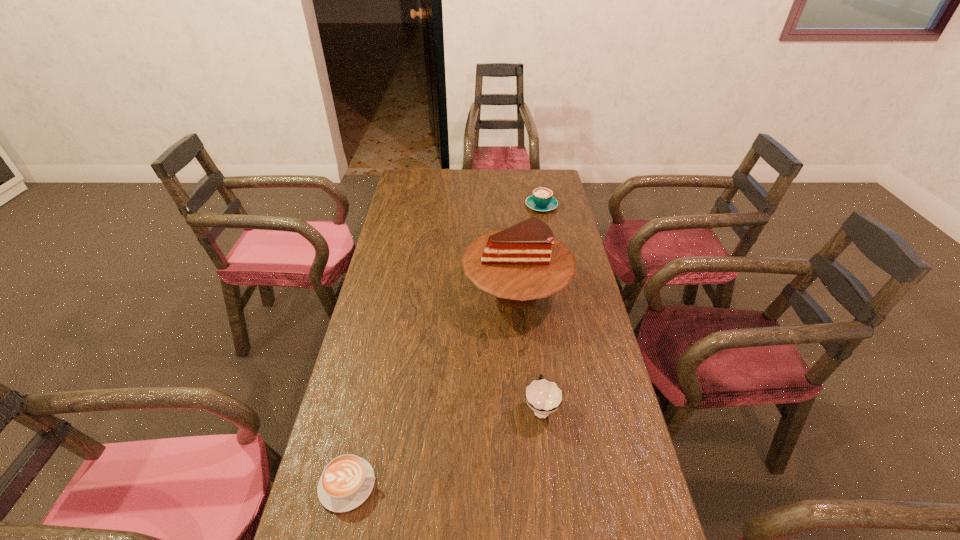
Image resolution: width=960 pixels, height=540 pixels. Identify the location of vacant space located on the side of the cup with the handle. pos(537,373).

What are the coordinates of `vacant space located 0.120m on the side of the cup with the handle` in the screenshot? It's located at (535, 353).

Locate an element on the screen. The height and width of the screenshot is (540, 960). blank space located with the handle on the right side of the right cappuccino is located at coordinates (539, 191).

At what (x,y) coordinates should I click in order to perform the action: click on vacant region located 0.130m with the handle on the right side of the right cappuccino. Please return your answer as a coordinate pair (x, y). Looking at the image, I should click on (537, 183).

Find the location of `free space located 0.140m with the handle on the right side of the right cappuccino`. free space located 0.140m with the handle on the right side of the right cappuccino is located at coordinates (537, 182).

This screenshot has width=960, height=540. Find the location of `vacant space located 0.340m on the side of the shorter cappuccino with the handle`. vacant space located 0.340m on the side of the shorter cappuccino with the handle is located at coordinates (529, 484).

Identify the location of object that is at the left edge. click(346, 482).

The image size is (960, 540). I want to click on cake that is at the right edge, so click(x=525, y=262).

I want to click on cappuccino at the right edge, so click(542, 199).

Where is `free region at the far edge of the desktop`? This screenshot has width=960, height=540. free region at the far edge of the desktop is located at coordinates (486, 191).